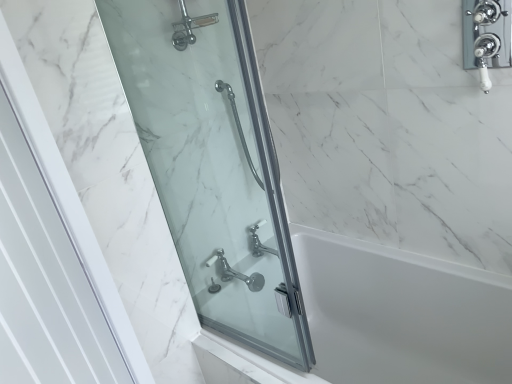
Question: From the image's perspective, is clear glass shower door at left, which appears as the 2th screen door when viewed from the front, located beneath white glossy door at left, which is the first screen door from front to back?

Choices:
 (A) yes
 (B) no

Answer: (B)

Question: From a real-world perspective, does clear glass shower door at left, the 1th screen door from the back, stand above white glossy door at left, which is counted as the second screen door, starting from the back?

Choices:
 (A) no
 (B) yes

Answer: (B)

Question: Is white glossy door at left, which is counted as the second screen door, starting from the back, completely or partially inside clear glass shower door at left, which appears as the 2th screen door when viewed from the front?

Choices:
 (A) yes
 (B) no

Answer: (B)

Question: Considering the relative sizes of clear glass shower door at left, which appears as the 2th screen door when viewed from the front, and white glossy door at left, which is counted as the second screen door, starting from the back, in the image provided, is clear glass shower door at left, which appears as the 2th screen door when viewed from the front, wider than white glossy door at left, which is counted as the second screen door, starting from the back,?

Choices:
 (A) yes
 (B) no

Answer: (B)

Question: Does clear glass shower door at left, which appears as the 2th screen door when viewed from the front, have a lesser width compared to white glossy door at left, which is the first screen door from front to back?

Choices:
 (A) yes
 (B) no

Answer: (A)

Question: From the image's perspective, is white glossy bathtub at center located above or below polished chrome faucet at lower center?

Choices:
 (A) above
 (B) below

Answer: (B)

Question: Relative to polished chrome faucet at lower center, is white glossy bathtub at center in front or behind?

Choices:
 (A) front
 (B) behind

Answer: (A)

Question: Considering the positions of white glossy bathtub at center and polished chrome faucet at lower center in the image, is white glossy bathtub at center wider or thinner than polished chrome faucet at lower center?

Choices:
 (A) thin
 (B) wide

Answer: (B)

Question: Do you think white glossy bathtub at center is within polished chrome faucet at lower center, or outside of it?

Choices:
 (A) outside
 (B) inside

Answer: (A)

Question: Relative to white glossy door at left, which is counted as the second screen door, starting from the back, is polished chrome faucet at lower center in front or behind?

Choices:
 (A) behind
 (B) front

Answer: (A)

Question: Looking at the image, does polished chrome faucet at lower center seem bigger or smaller compared to white glossy door at left, which is counted as the second screen door, starting from the back?

Choices:
 (A) big
 (B) small

Answer: (B)

Question: Would you say polished chrome faucet at lower center is inside or outside white glossy door at left, which is counted as the second screen door, starting from the back?

Choices:
 (A) inside
 (B) outside

Answer: (B)

Question: From the image's perspective, is polished chrome faucet at lower center located above or below white glossy door at left, which is counted as the second screen door, starting from the back?

Choices:
 (A) above
 (B) below

Answer: (B)

Question: From the image's perspective, is white glossy door at left, which is the first screen door from front to back, located above or below polished chrome faucet at lower center?

Choices:
 (A) below
 (B) above

Answer: (B)

Question: Considering the relative positions of white glossy door at left, which is counted as the second screen door, starting from the back, and polished chrome faucet at lower center in the image provided, is white glossy door at left, which is counted as the second screen door, starting from the back, to the left or to the right of polished chrome faucet at lower center?

Choices:
 (A) left
 (B) right

Answer: (A)